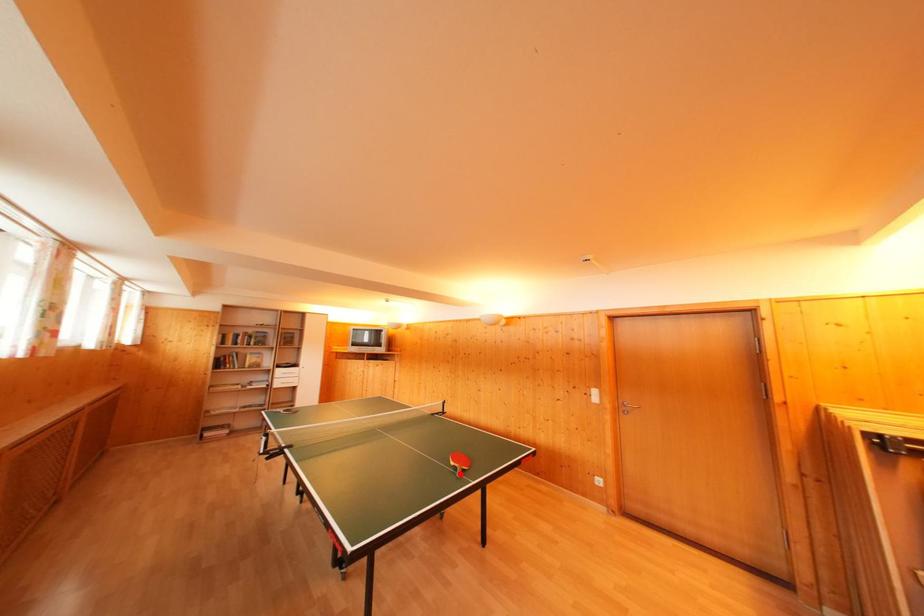
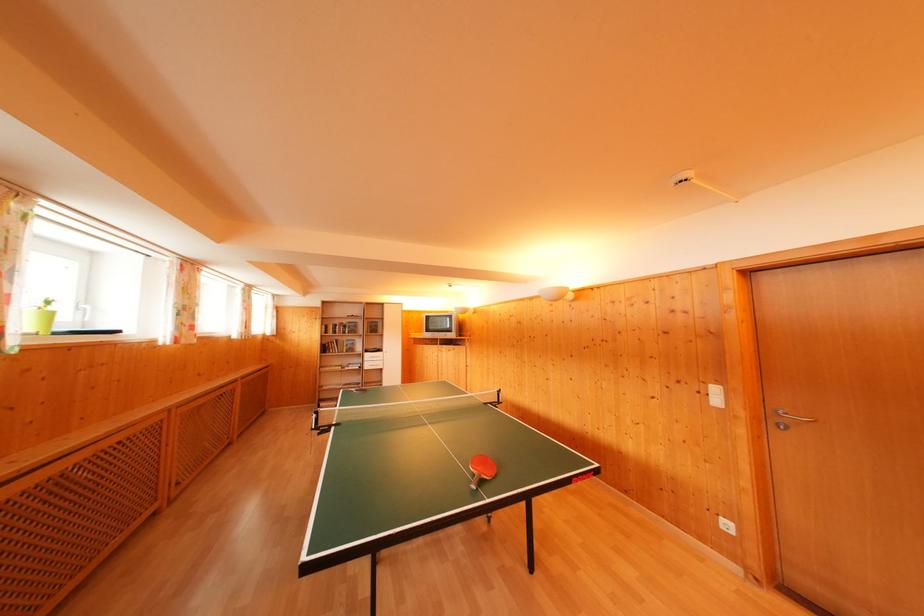
The point at the highlighted location is marked in the first image. Where is the corresponding point in the second image?

(478, 482)